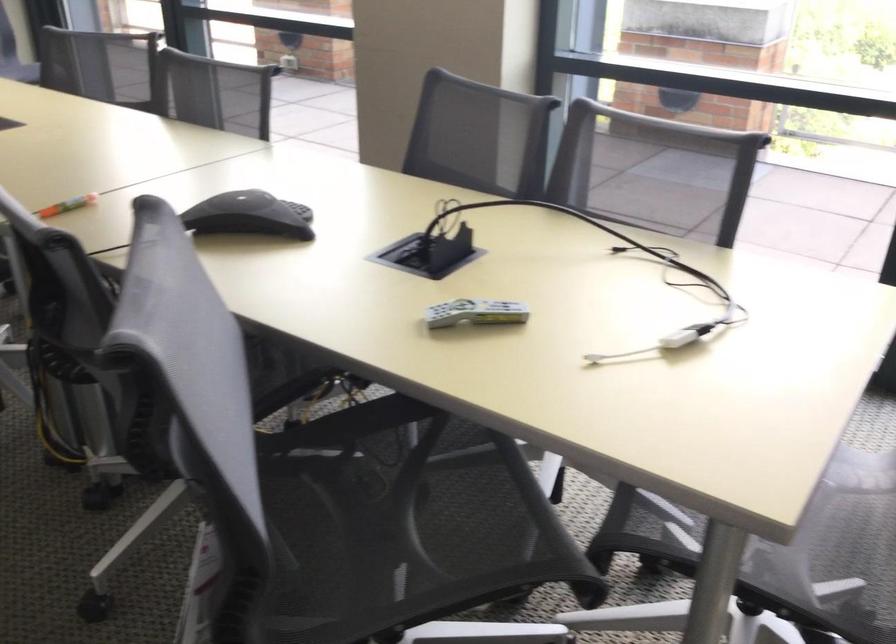
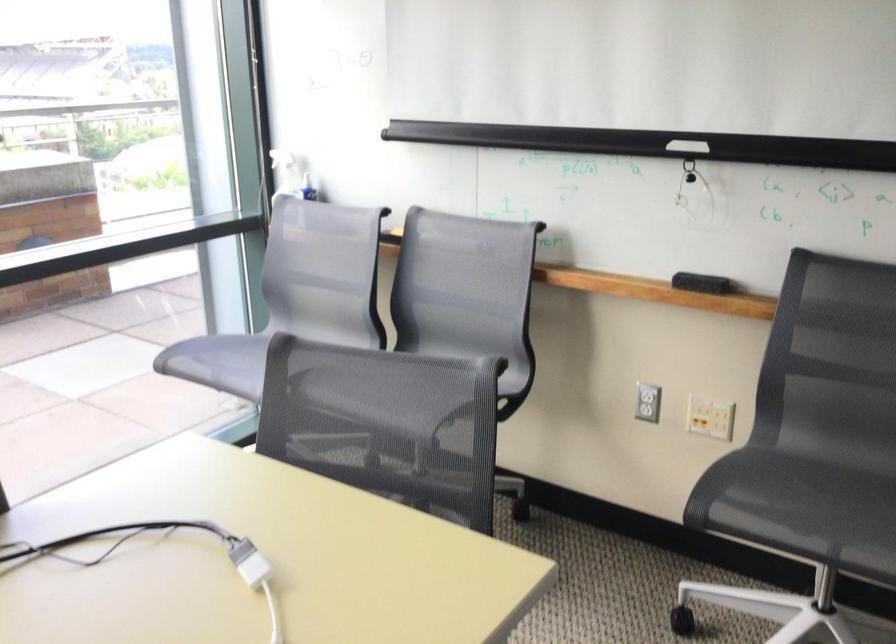
In the second image, find the point that corresponds to (x=684, y=317) in the first image.

(161, 554)